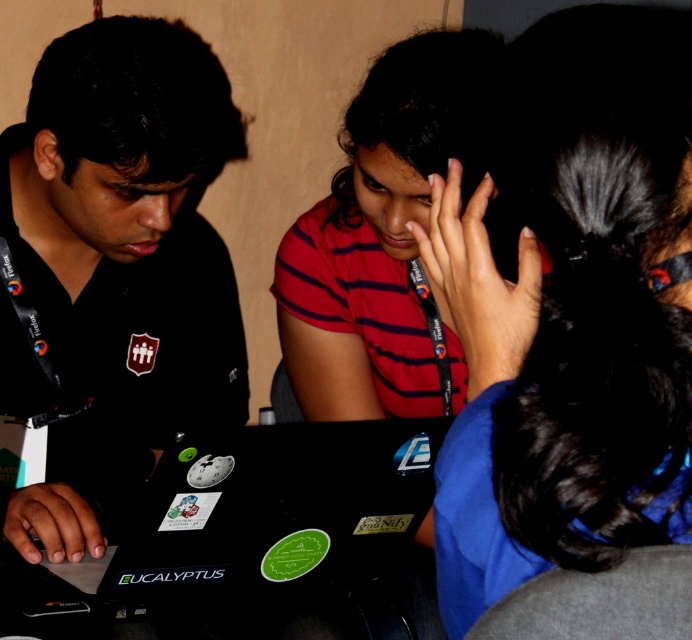
The image size is (692, 640). I want to click on red striped shirt at center, so click(x=385, y=236).

Can you confirm if red striped shirt at center is positioned below black matte laptop at center?

No, red striped shirt at center is not below black matte laptop at center.

Identify the location of red striped shirt at center. (385, 236).

Is black glossy hair at upper right bigger than black matte shirt at left?

Incorrect, black glossy hair at upper right is not larger than black matte shirt at left.

Between black glossy hair at upper right and black matte shirt at left, which one appears on the right side from the viewer's perspective?

Positioned to the right is black glossy hair at upper right.

What do you see at coordinates (573, 316) in the screenshot? This screenshot has height=640, width=692. I see `black glossy hair at upper right` at bounding box center [573, 316].

At what (x,y) coordinates should I click in order to perform the action: click on black glossy hair at upper right. Please return your answer as a coordinate pair (x, y). Looking at the image, I should click on (573, 316).

Is point (69, 380) positioned behind point (401, 193)?

Yes, point (69, 380) is farther from viewer.

This screenshot has width=692, height=640. Identify the location of black matte shirt at left. (116, 268).

Is point (194, 282) in front of point (446, 108)?

No, (194, 282) is further to viewer.

Locate an element on the screen. This screenshot has height=640, width=692. black matte shirt at left is located at coordinates (116, 268).